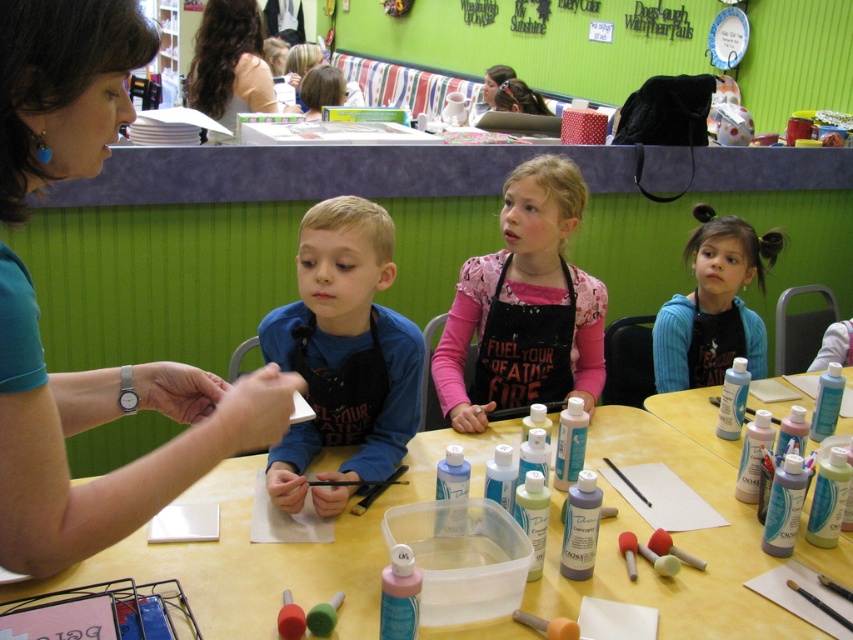
You are a student in the classroom and need to locate the teacher. The teacher is wearing the matte teal shirt at upper left. Which side of the yellow matte table at center should you look towards to find the teacher?

The matte teal shirt at upper left is to the left of the yellow matte table at center, so you should look towards the left side of the yellow matte table at center to find the teacher.

From the picture: You are a child sitting at the yellow matte table at center. You want to hand your artwork to the teacher wearing the matte teal shirt at upper left. Can you reach the teacher without moving from your seat?

The matte teal shirt at upper left is 25.84 inches away from the yellow matte table at center. Since the average arm length of a child is about 20 inches, the child cannot reach the teacher without moving from their seat.

What color is the shirt of the boy located at point (102, 422)?

The shirt at point (102, 422) is matte teal.